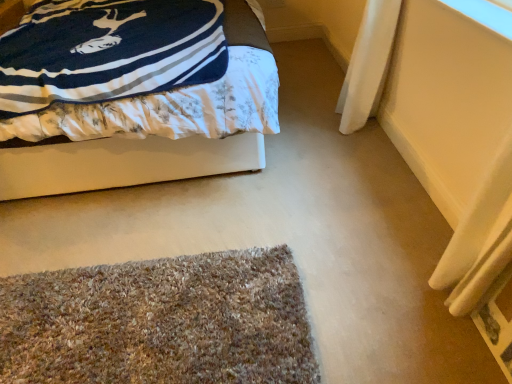
Question: Can you confirm if multicolored shaggy mat at lower center is bigger than transparent plastic window screen at upper right?

Choices:
 (A) yes
 (B) no

Answer: (A)

Question: Is multicolored shaggy mat at lower center smaller than transparent plastic window screen at upper right?

Choices:
 (A) no
 (B) yes

Answer: (A)

Question: Is multicolored shaggy mat at lower center further to the viewer compared to transparent plastic window screen at upper right?

Choices:
 (A) no
 (B) yes

Answer: (A)

Question: Is multicolored shaggy mat at lower center thinner than transparent plastic window screen at upper right?

Choices:
 (A) yes
 (B) no

Answer: (B)

Question: Is the position of multicolored shaggy mat at lower center less distant than that of transparent plastic window screen at upper right?

Choices:
 (A) no
 (B) yes

Answer: (B)

Question: From the image's perspective, is transparent plastic window screen at upper right positioned above or below velvet-like blue blanket at upper left?

Choices:
 (A) above
 (B) below

Answer: (B)

Question: From a real-world perspective, relative to velvet-like blue blanket at upper left, is transparent plastic window screen at upper right vertically above or below?

Choices:
 (A) below
 (B) above

Answer: (B)

Question: Visually, is transparent plastic window screen at upper right positioned to the left or to the right of velvet-like blue blanket at upper left?

Choices:
 (A) left
 (B) right

Answer: (B)

Question: Based on their sizes in the image, would you say transparent plastic window screen at upper right is bigger or smaller than velvet-like blue blanket at upper left?

Choices:
 (A) big
 (B) small

Answer: (B)

Question: In terms of size, does velvet-like blue blanket at upper left appear bigger or smaller than transparent plastic window screen at upper right?

Choices:
 (A) small
 (B) big

Answer: (B)

Question: Is point (221, 155) closer or farther from the camera than point (499, 24)?

Choices:
 (A) closer
 (B) farther

Answer: (B)

Question: Is velvet-like blue blanket at upper left inside or outside of transparent plastic window screen at upper right?

Choices:
 (A) inside
 (B) outside

Answer: (B)

Question: From the image's perspective, relative to transparent plastic window screen at upper right, is velvet-like blue blanket at upper left above or below?

Choices:
 (A) below
 (B) above

Answer: (B)

Question: From their relative heights in the image, would you say multicolored shaggy mat at lower center is taller or shorter than transparent plastic window screen at upper right?

Choices:
 (A) tall
 (B) short

Answer: (A)

Question: Considering the positions of multicolored shaggy mat at lower center and transparent plastic window screen at upper right in the image, is multicolored shaggy mat at lower center wider or thinner than transparent plastic window screen at upper right?

Choices:
 (A) wide
 (B) thin

Answer: (A)